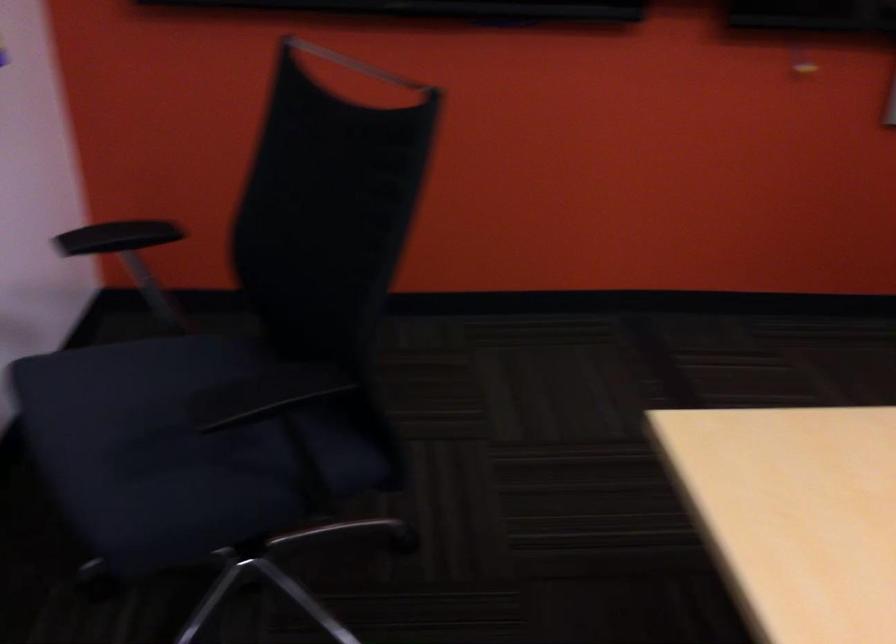
Where is `chair sitting surface`? chair sitting surface is located at coordinates (167, 442).